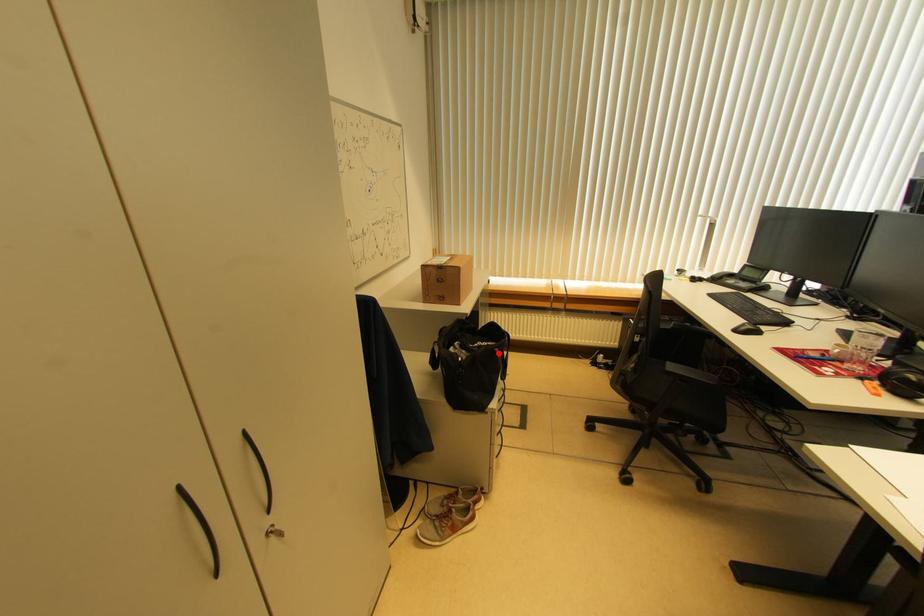
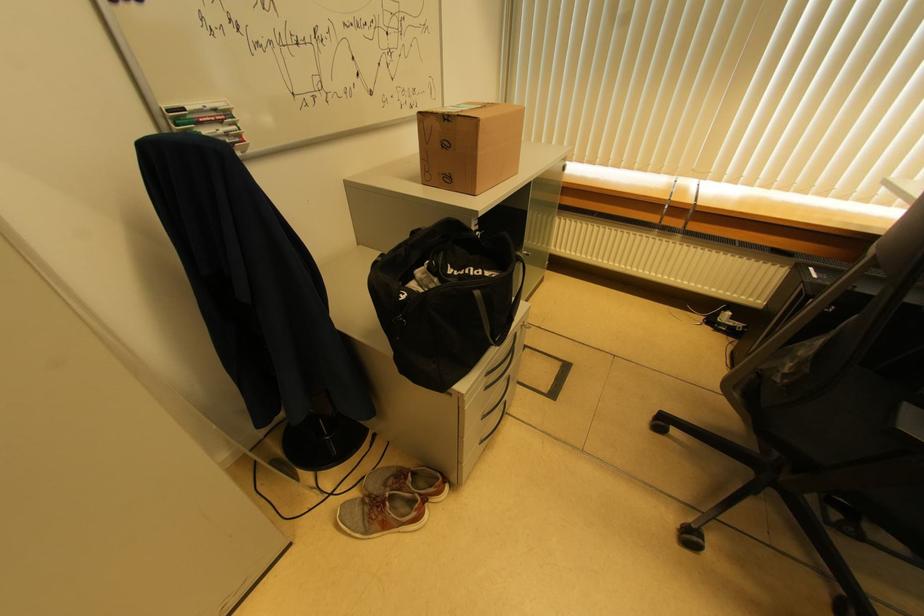
The point at the highlighted location is marked in the first image. Where is the corresponding point in the second image?

(479, 296)